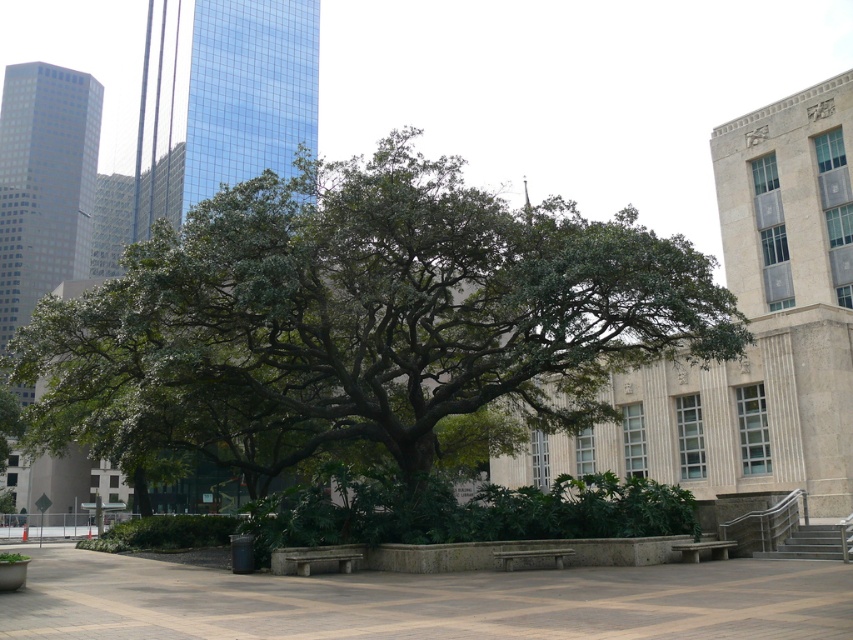
Is green leafy tree at center to the right of stone bench at center from the viewer's perspective?

No, green leafy tree at center is not to the right of stone bench at center.

Does green leafy tree at center have a smaller size compared to stone bench at center?

Incorrect, green leafy tree at center is not smaller in size than stone bench at center.

Is point (28, 420) farther from viewer compared to point (271, 563)?

Yes, point (28, 420) is farther from viewer.

Identify the location of green leafy tree at center. The width and height of the screenshot is (853, 640). pyautogui.click(x=360, y=321).

Can you confirm if stone bench at lower right is bigger than wooden bench at center?

Indeed, stone bench at lower right has a larger size compared to wooden bench at center.

Consider the image. Between stone bench at lower right and wooden bench at center, which one has less height?

With less height is wooden bench at center.

Who is more forward, (x=701, y=544) or (x=531, y=554)?

Point (x=531, y=554) is more forward.

Where is `stone bench at lower right`? The image size is (853, 640). stone bench at lower right is located at coordinates (703, 548).

Who is taller, green leafy tree at center or stone bench at lower right?

green leafy tree at center

Find the location of `green leafy tree at center`. green leafy tree at center is located at coordinates (360, 321).

Locate an element on the screen. Image resolution: width=853 pixels, height=640 pixels. green leafy tree at center is located at coordinates (360, 321).

Find the location of `green leafy tree at center`. green leafy tree at center is located at coordinates (360, 321).